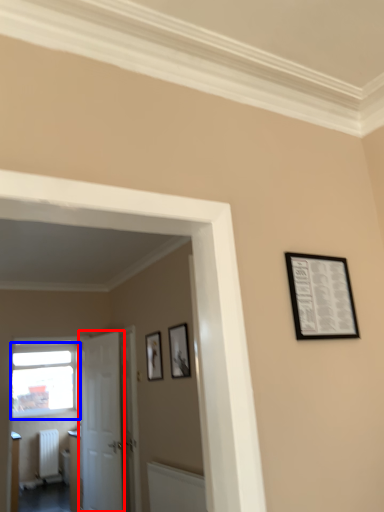
Question: Which of the following is the farthest to the observer, door (highlighted by a red box) or window (highlighted by a blue box)?

Choices:
 (A) door
 (B) window

Answer: (B)